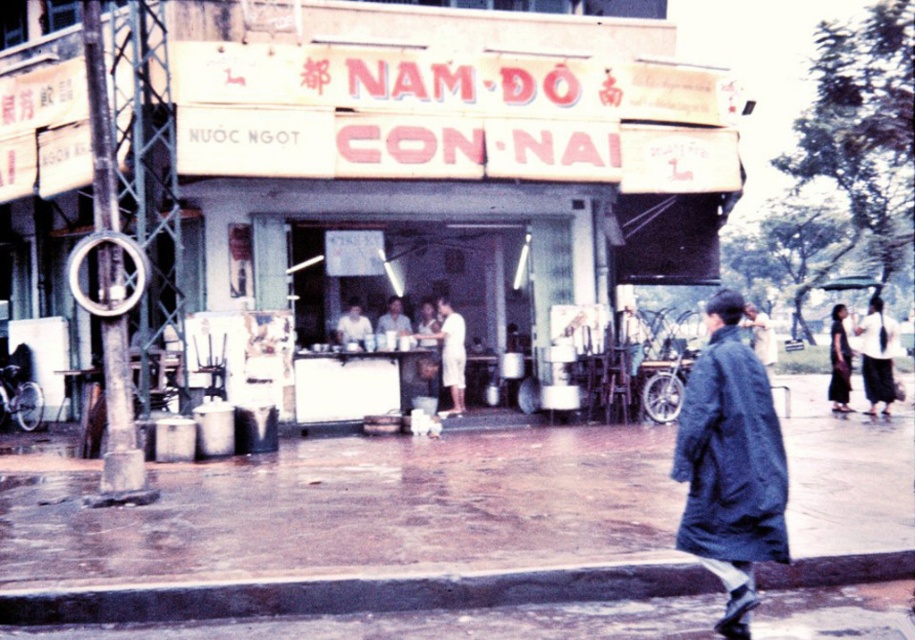
Question: Is white cloth at center below white matte shirt at center?

Choices:
 (A) no
 (B) yes

Answer: (B)

Question: Which of the following is the closest to the observer?

Choices:
 (A) white matte shirt at center
 (B) wet asphalt pavement at lower center
 (C) dark blue fabric coat at lower right

Answer: (C)

Question: Among these points, which one is farthest from the camera?

Choices:
 (A) (831, 364)
 (B) (358, 310)
 (C) (852, 490)

Answer: (A)

Question: Does white cotton shirt at right appear on the left side of white cloth at center?

Choices:
 (A) no
 (B) yes

Answer: (A)

Question: Which object is the closest to the white uniform at center?

Choices:
 (A) dark blue fabric coat at lower right
 (B) white cloth at center
 (C) white matte shirt at center
 (D) yellowish faded signboard at center

Answer: (C)

Question: Does yellowish faded signboard at center appear on the right side of white matte shirt at center?

Choices:
 (A) yes
 (B) no

Answer: (B)